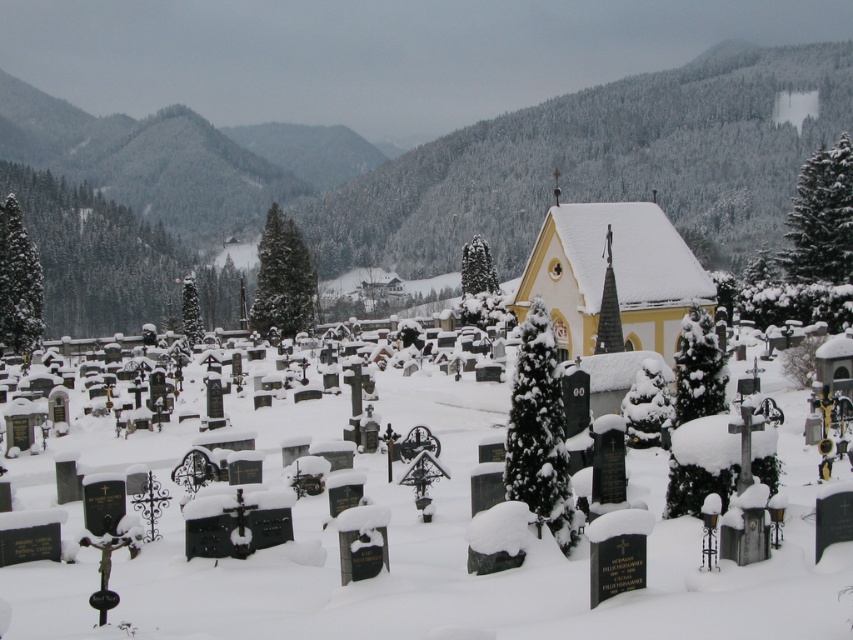
Question: Is white matte snow at center closer to camera compared to yellow matte church at center?

Choices:
 (A) yes
 (B) no

Answer: (A)

Question: Does white matte snow at center appear on the right side of yellow matte church at center?

Choices:
 (A) yes
 (B) no

Answer: (B)

Question: Among these points, which one is nearest to the camera?

Choices:
 (A) (563, 204)
 (B) (271, 547)

Answer: (B)

Question: Among these points, which one is nearest to the camera?

Choices:
 (A) (656, 490)
 (B) (651, 209)

Answer: (A)

Question: Is white matte snow at center further to camera compared to yellow matte church at center?

Choices:
 (A) no
 (B) yes

Answer: (A)